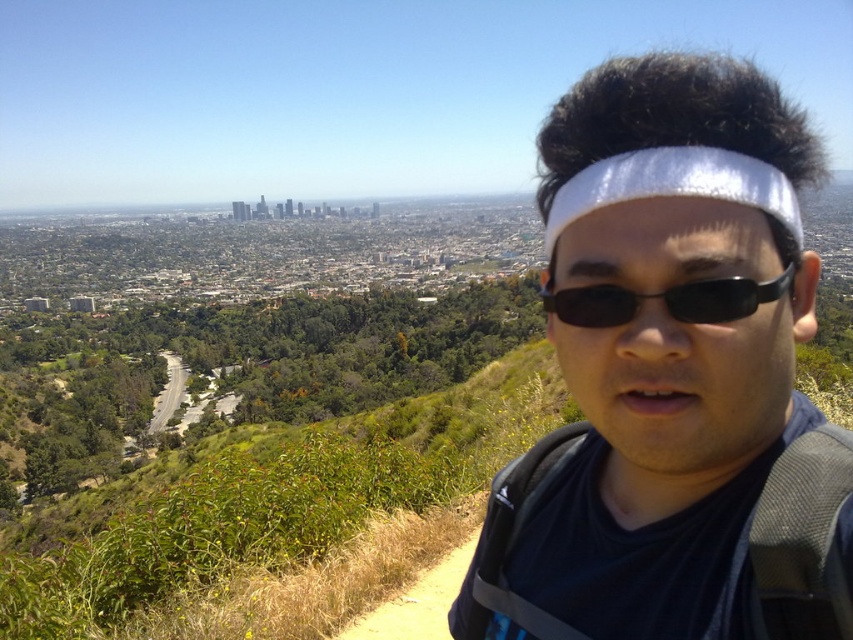
Who is taller, white reflective headband at center or black plastic sunglasses at center?

Standing taller between the two is white reflective headband at center.

Which of these two, white reflective headband at center or black plastic sunglasses at center, stands shorter?

black plastic sunglasses at center

Which is behind, point (759, 285) or point (729, 310)?

Positioned behind is point (729, 310).

Locate an element on the screen. The width and height of the screenshot is (853, 640). white reflective headband at center is located at coordinates (669, 374).

Is black plastic sunglasses at center further to camera compared to white matte headband at center?

That is True.

Does black plastic sunglasses at center appear on the left side of white matte headband at center?

Indeed, black plastic sunglasses at center is positioned on the left side of white matte headband at center.

Between point (592, 305) and point (775, 220), which one is positioned behind?

Point (592, 305)

Where is `black plastic sunglasses at center`? black plastic sunglasses at center is located at coordinates (665, 300).

Does white reflective headband at center have a smaller size compared to white matte headband at center?

Incorrect, white reflective headband at center is not smaller in size than white matte headband at center.

Does white reflective headband at center have a lesser height compared to white matte headband at center?

Incorrect, white reflective headband at center's height does not fall short of white matte headband at center's.

Image resolution: width=853 pixels, height=640 pixels. Identify the location of white reflective headband at center. (669, 374).